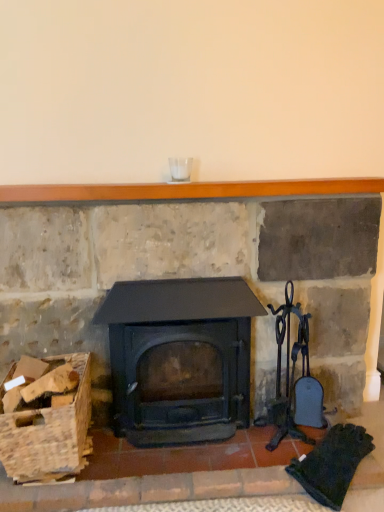
At what (x,y) coordinates should I click in order to perform the action: click on free point to the right of wooden crate at lower left. Please return your answer as a coordinate pair (x, y). This screenshot has width=384, height=512. Looking at the image, I should click on (134, 475).